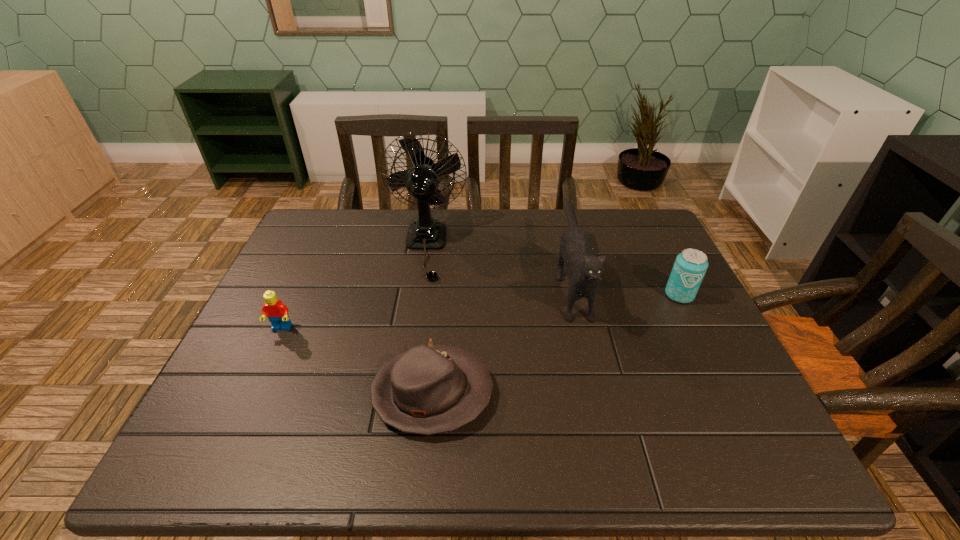
Identify the location of vacant space at the right edge. Image resolution: width=960 pixels, height=540 pixels. (705, 395).

Locate an element on the screen. The image size is (960, 540). free space at the far left corner of the desktop is located at coordinates (304, 227).

The height and width of the screenshot is (540, 960). Identify the location of vacant region at the far right corner of the desktop. (614, 234).

Where is `vacant area between the nearest object and the leftmost object`? vacant area between the nearest object and the leftmost object is located at coordinates (357, 361).

At what (x,y) coordinates should I click in order to perform the action: click on free spot between the nearest object and the beer can. Please return your answer as a coordinate pair (x, y). The width and height of the screenshot is (960, 540). Looking at the image, I should click on (556, 344).

In order to click on free space between the second tallest object and the leftmost object in this screenshot , I will do `click(426, 305)`.

Find the location of `empty location between the hat and the Lego`. empty location between the hat and the Lego is located at coordinates (357, 361).

The width and height of the screenshot is (960, 540). In order to click on free space between the fan and the beer can in this screenshot , I will do `click(552, 271)`.

Image resolution: width=960 pixels, height=540 pixels. I want to click on vacant area that lies between the tallest object and the rightmost object, so click(x=552, y=271).

Identify the location of empty space that is in between the beer can and the tallest object. (552, 271).